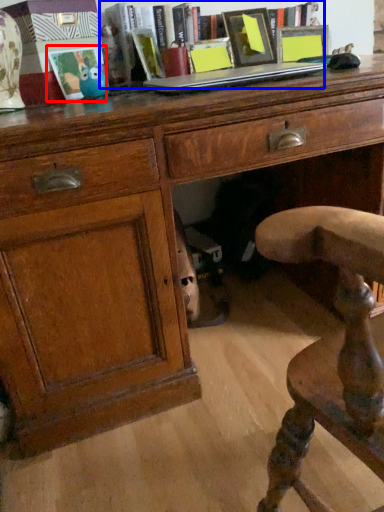
Question: Which point is further to the camera, picture frame (highlighted by a red box) or book (highlighted by a blue box)?

Choices:
 (A) picture frame
 (B) book

Answer: (B)